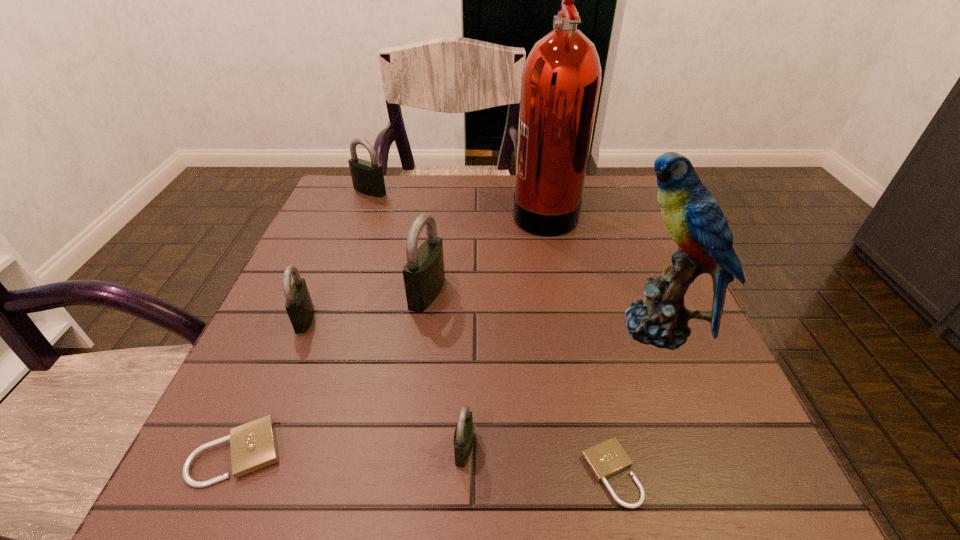
Where is `fire extinguisher at the right edge`? Image resolution: width=960 pixels, height=540 pixels. fire extinguisher at the right edge is located at coordinates (561, 78).

Find the location of a particular element. The height and width of the screenshot is (540, 960). parrot situated at the right edge is located at coordinates (694, 220).

The height and width of the screenshot is (540, 960). I want to click on object situated at the far left corner, so click(x=367, y=177).

Locate an element on the screen. This screenshot has height=540, width=960. object at the near left corner is located at coordinates pyautogui.click(x=253, y=445).

Locate an element on the screen. object that is positioned at the far right corner is located at coordinates (561, 78).

This screenshot has width=960, height=540. Find the location of `blank space at the far edge of the desktop`. blank space at the far edge of the desktop is located at coordinates pos(453,202).

Locate an element on the screen. This screenshot has height=540, width=960. free space at the near edge is located at coordinates (564, 450).

In the image, there is a desktop. What are the coordinates of `blank space at the left edge` in the screenshot? It's located at (357, 224).

You are a GUI agent. You are given a task and a screenshot of the screen. Output one action in this format:
    pyautogui.click(x=<x>, y=<y>)
    Task: Click on the vacant area at the right edge
    This screenshot has width=960, height=540.
    Given the screenshot: What is the action you would take?
    click(600, 246)

You are a GUI agent. You are given a task and a screenshot of the screen. Output one action in this format:
    pyautogui.click(x=<x>, y=<y>)
    Task: Click on the vacant space at the near left corner of the desktop
    The width and height of the screenshot is (960, 540).
    Given the screenshot: What is the action you would take?
    pyautogui.click(x=199, y=474)